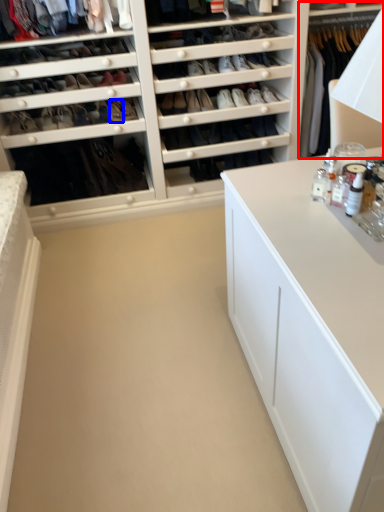
Question: Among these objects, which one is farthest to the camera, dresser (highlighted by a red box) or shoe (highlighted by a blue box)?

Choices:
 (A) dresser
 (B) shoe

Answer: (B)